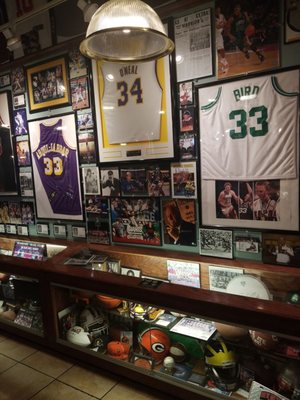
Locate an element on the screen. light is located at coordinates (129, 20).